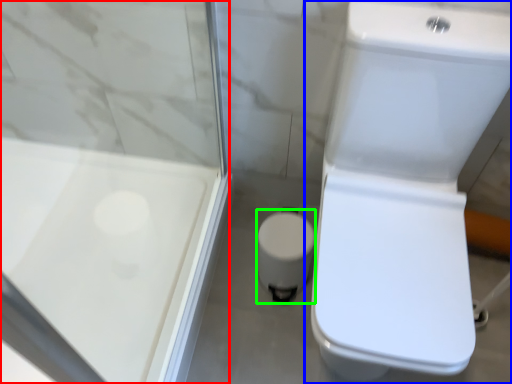
Question: Which is farther away from screen door (highlighted by a red box)? toilet (highlighted by a blue box) or porcelain (highlighted by a green box)?

Choices:
 (A) toilet
 (B) porcelain

Answer: (A)